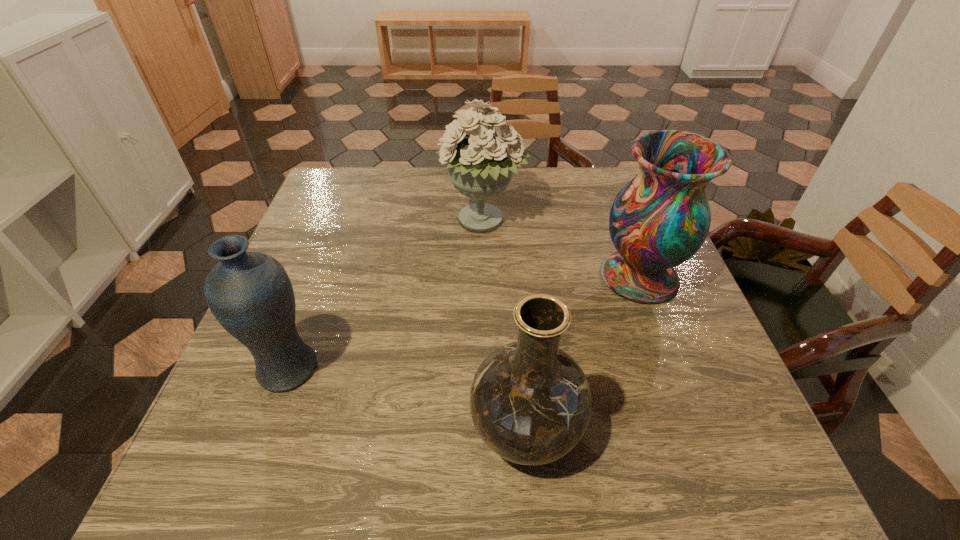
In order to click on object that is at the near edge in this screenshot , I will do `click(531, 403)`.

In order to click on object that is at the left edge in this screenshot , I will do `click(250, 294)`.

In order to click on object located at the right edge in this screenshot , I will do `click(660, 219)`.

Locate an element on the screen. This screenshot has width=960, height=540. free space at the far edge of the desktop is located at coordinates (574, 187).

Identify the location of free space at the near edge of the desktop. (298, 462).

What are the coordinates of `free region at the left edge of the desktop` in the screenshot? It's located at (346, 217).

In the image, there is a desktop. Find the location of `free space at the right edge`. free space at the right edge is located at coordinates (693, 394).

Image resolution: width=960 pixels, height=540 pixels. What are the coordinates of `free space at the far left corner of the desktop` in the screenshot? It's located at (334, 207).

The height and width of the screenshot is (540, 960). I want to click on free space at the far right corner of the desktop, so click(618, 172).

Locate an element on the screen. The image size is (960, 540). vacant space in between the leftmost vase and the farthest object is located at coordinates (386, 295).